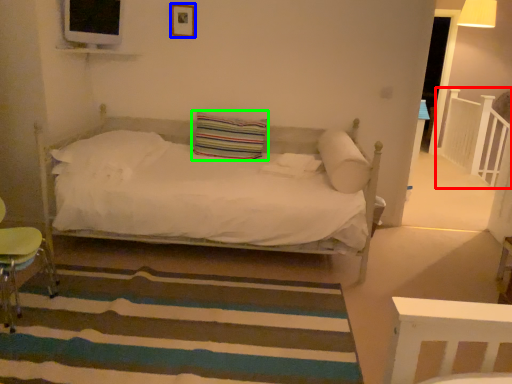
Question: Estimate the real-world distances between objects in this image. Which object is closer to balustrade (highlighted by a red box), picture frame (highlighted by a blue box) or pillow (highlighted by a green box)?

Choices:
 (A) picture frame
 (B) pillow

Answer: (B)